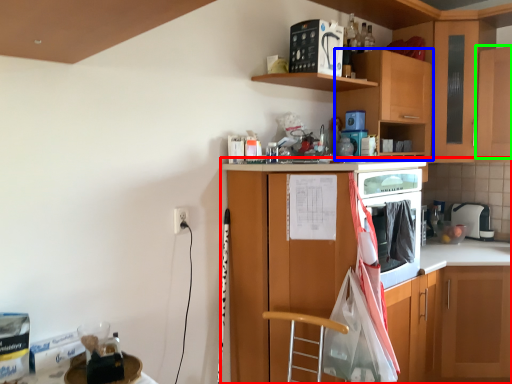
Question: Which object is the closest to the cabinetry (highlighted by a red box)? Choose among these: cabinetry (highlighted by a blue box) or cabinetry (highlighted by a green box).

Choices:
 (A) cabinetry
 (B) cabinetry

Answer: (A)